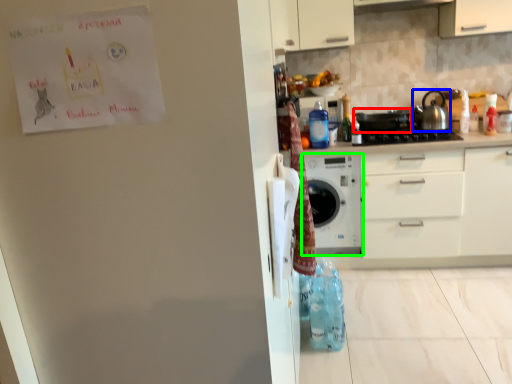
Question: Which object is positioned farthest from appliance (highlighted by a red box)? Select from kitchen appliance (highlighted by a blue box) and home appliance (highlighted by a green box).

Choices:
 (A) kitchen appliance
 (B) home appliance

Answer: (B)